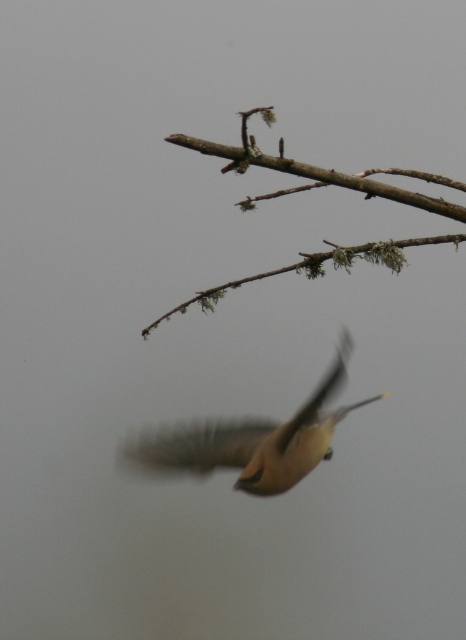
How much distance is there between brown feathered bird at center and brown mossy branch at upper center?

brown feathered bird at center and brown mossy branch at upper center are 30.90 centimeters apart from each other.

Find the location of a particular element. Image resolution: width=466 pixels, height=640 pixels. brown feathered bird at center is located at coordinates (254, 440).

Who is more forward, (241, 445) or (397, 198)?

Positioned in front is point (397, 198).

The image size is (466, 640). Find the location of `brown feathered bird at center`. brown feathered bird at center is located at coordinates (254, 440).